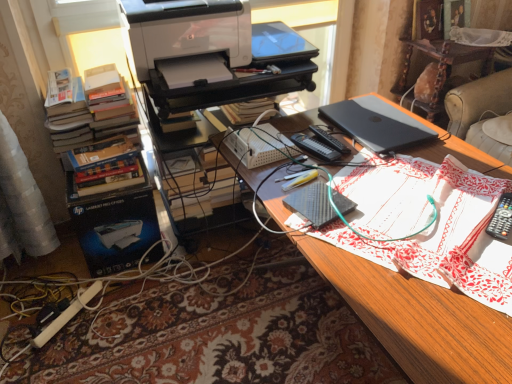
Question: Is white plastic printer at upper center, acting as the second computer desk starting from the right, turned away from beige leather couch at upper right?

Choices:
 (A) yes
 (B) no

Answer: (B)

Question: Considering the relative sizes of white plastic printer at upper center, positioned as the 1th computer desk in left-to-right order, and beige leather couch at upper right in the image provided, is white plastic printer at upper center, positioned as the 1th computer desk in left-to-right order, thinner than beige leather couch at upper right?

Choices:
 (A) no
 (B) yes

Answer: (A)

Question: Would you say white plastic printer at upper center, positioned as the 1th computer desk in left-to-right order, is outside beige leather couch at upper right?

Choices:
 (A) yes
 (B) no

Answer: (A)

Question: Is white plastic printer at upper center, positioned as the 1th computer desk in left-to-right order, bigger than beige leather couch at upper right?

Choices:
 (A) no
 (B) yes

Answer: (B)

Question: Considering the relative sizes of white plastic printer at upper center, positioned as the 1th computer desk in left-to-right order, and beige leather couch at upper right in the image provided, is white plastic printer at upper center, positioned as the 1th computer desk in left-to-right order, taller than beige leather couch at upper right?

Choices:
 (A) no
 (B) yes

Answer: (B)

Question: Considering the relative positions of white plastic printer at upper center, positioned as the 1th computer desk in left-to-right order, and beige leather couch at upper right in the image provided, is white plastic printer at upper center, positioned as the 1th computer desk in left-to-right order, to the left of beige leather couch at upper right from the viewer's perspective?

Choices:
 (A) no
 (B) yes

Answer: (B)

Question: Is white matte printer at upper left closer to the viewer compared to black matte laptop at upper right?

Choices:
 (A) no
 (B) yes

Answer: (B)

Question: From the image's perspective, is white matte printer at upper left located above black matte laptop at upper right?

Choices:
 (A) no
 (B) yes

Answer: (B)

Question: Is white matte printer at upper left to the right of black matte laptop at upper right from the viewer's perspective?

Choices:
 (A) no
 (B) yes

Answer: (A)

Question: Can you confirm if white matte printer at upper left is bigger than black matte laptop at upper right?

Choices:
 (A) yes
 (B) no

Answer: (A)

Question: Is white matte printer at upper left smaller than black matte laptop at upper right?

Choices:
 (A) yes
 (B) no

Answer: (B)

Question: From a real-world perspective, is white matte printer at upper left on top of black matte laptop at upper right?

Choices:
 (A) yes
 (B) no

Answer: (A)

Question: Can you confirm if white matte printer at upper left is thinner than black textured notebook at center?

Choices:
 (A) yes
 (B) no

Answer: (B)